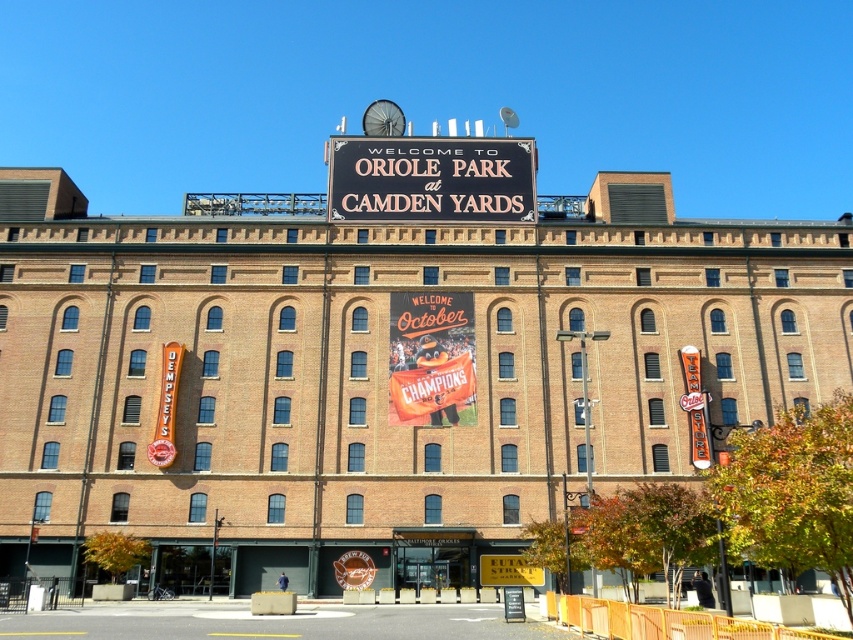
Question: Which of the following is the farthest from the observer?

Choices:
 (A) (463, 168)
 (B) (448, 369)

Answer: (A)

Question: Which point appears closest to the camera in this image?

Choices:
 (A) (393, 212)
 (B) (424, 321)

Answer: (B)

Question: Which object is closer to the camera taking this photo?

Choices:
 (A) orange fabric banner at center
 (B) black matte sign at center

Answer: (A)

Question: Is black matte sign at center bigger than orange fabric banner at center?

Choices:
 (A) no
 (B) yes

Answer: (B)

Question: Does black matte sign at center come behind orange fabric banner at center?

Choices:
 (A) no
 (B) yes

Answer: (B)

Question: From the image, what is the correct spatial relationship of black matte sign at center in relation to orange fabric banner at center?

Choices:
 (A) right
 (B) left

Answer: (B)